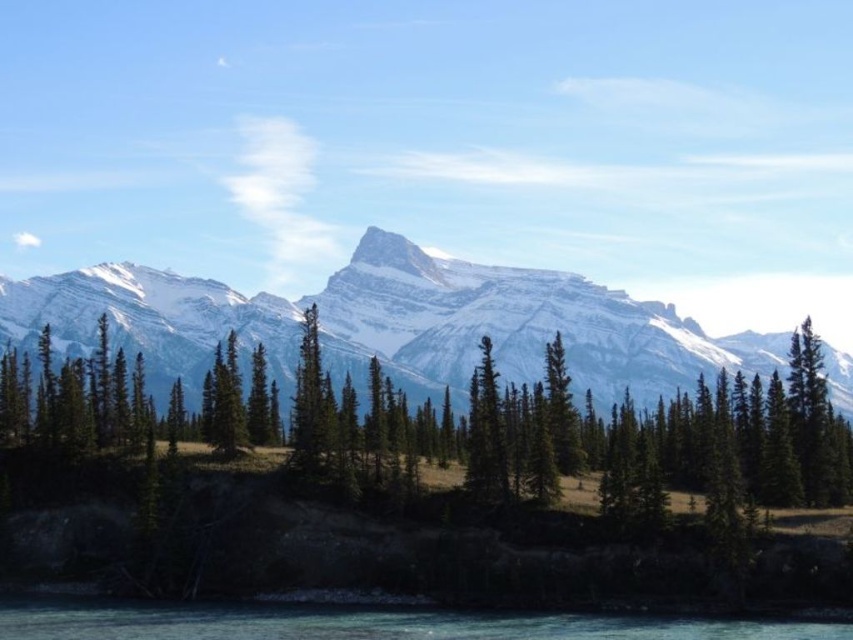
Consider the image. Is green textured pine trees at center below snowy granite mountain range at center?

Yes, green textured pine trees at center is below snowy granite mountain range at center.

Does green textured pine trees at center have a smaller size compared to snowy granite mountain range at center?

Correct, green textured pine trees at center occupies less space than snowy granite mountain range at center.

Which is behind, point (608, 490) or point (619, 356)?

Point (619, 356)

This screenshot has width=853, height=640. Find the location of `green textured pine trees at center`. green textured pine trees at center is located at coordinates (685, 440).

Which is behind, point (729, 456) or point (177, 621)?

Positioned behind is point (729, 456).

Can you confirm if green textured pine trees at center is positioned below clear blue water at lower center?

No.

Image resolution: width=853 pixels, height=640 pixels. Describe the element at coordinates (685, 440) in the screenshot. I see `green textured pine trees at center` at that location.

At what (x,y) coordinates should I click in order to perform the action: click on green textured pine trees at center. Please return your answer as a coordinate pair (x, y). Looking at the image, I should click on (685, 440).

Does snowy granite mountain range at center have a lesser width compared to green matte tree at center?

No, snowy granite mountain range at center is not thinner than green matte tree at center.

Looking at this image, is snowy granite mountain range at center further to the viewer compared to green matte tree at center?

Yes, snowy granite mountain range at center is behind green matte tree at center.

Does point (346, 266) lie behind point (474, 492)?

Yes.

Identify the location of snowy granite mountain range at center. click(x=392, y=323).